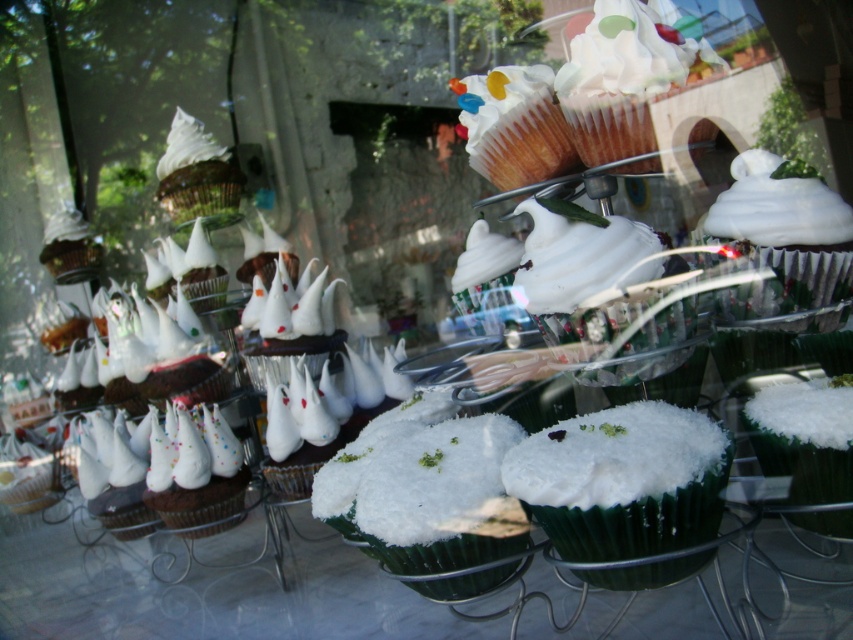
Question: Which point appears farthest from the camera in this image?

Choices:
 (A) (167, 166)
 (B) (834, 524)
 (C) (590, 499)

Answer: (A)

Question: Is white fluffy frosting at center above white glossy frosting at center?

Choices:
 (A) no
 (B) yes

Answer: (A)

Question: Based on their relative distances, which object is farther from the white fluffy cupcake at center?

Choices:
 (A) white glossy frosting at upper left
 (B) white fluffy frosting at center
 (C) white glossy frosting at center

Answer: (A)

Question: Can you confirm if white fluffy frosting at center is positioned above white glossy frosting at center?

Choices:
 (A) yes
 (B) no

Answer: (B)

Question: Considering the relative positions of white fluffy frosting at center and white glossy frosting at center in the image provided, where is white fluffy frosting at center located with respect to white glossy frosting at center?

Choices:
 (A) below
 (B) above

Answer: (A)

Question: Which is farther from the white glossy frosting at center?

Choices:
 (A) white fluffy frosting at center
 (B) white fluffy cupcake at center

Answer: (B)